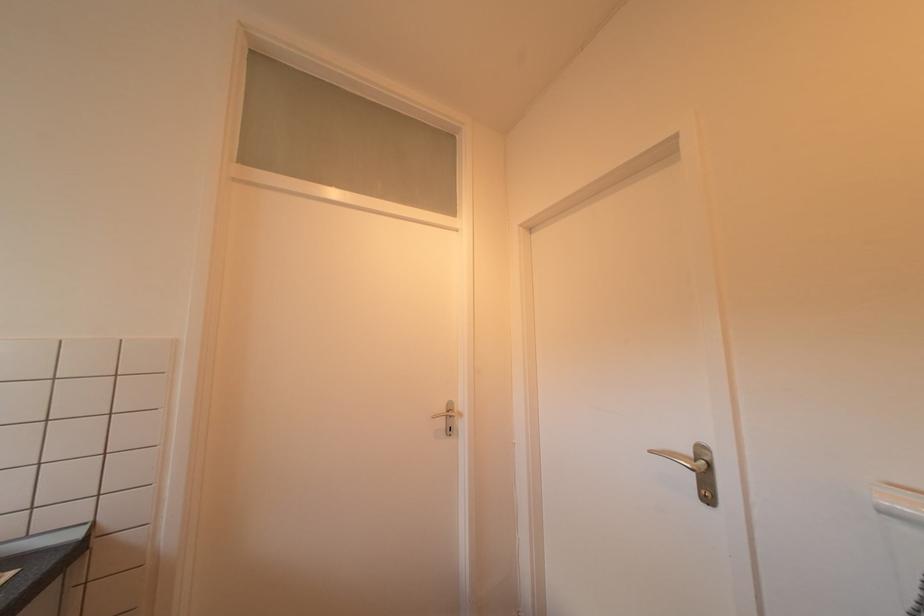
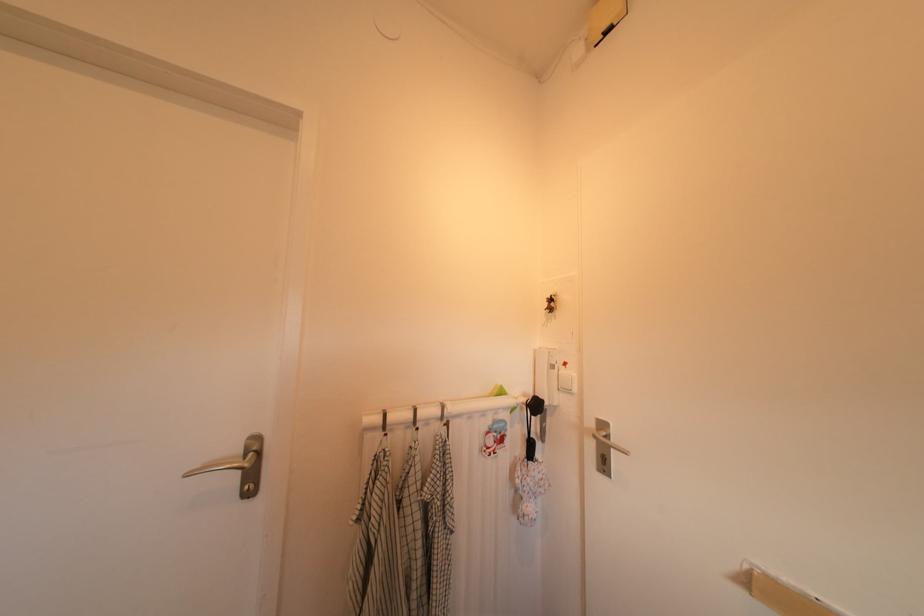
Question: The camera is either moving clockwise (left) or counter-clockwise (right) around the object. The first image is from the beginning of the video and the second image is from the end. Is the camera moving left or right when shooting the video?

Choices:
 (A) Left
 (B) Right

Answer: (A)